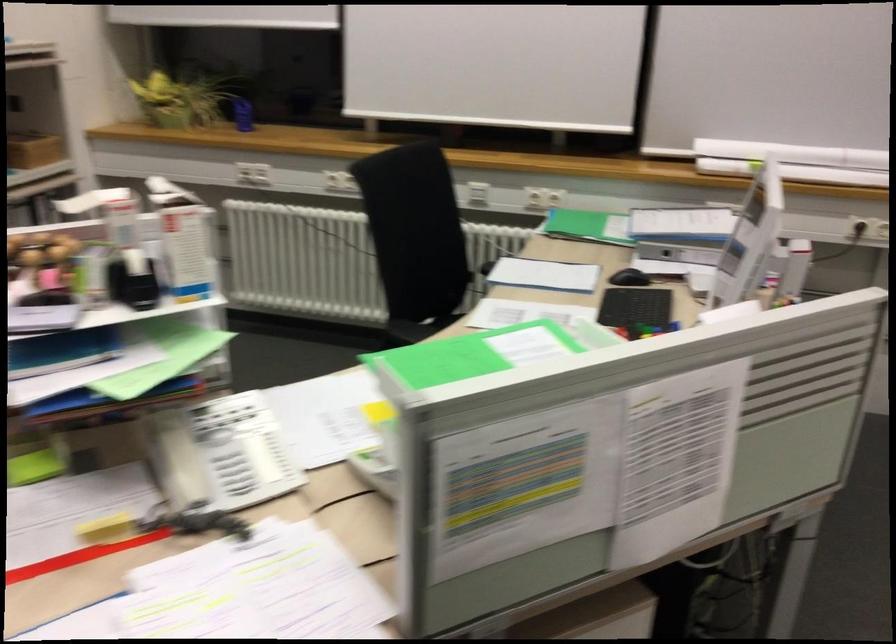
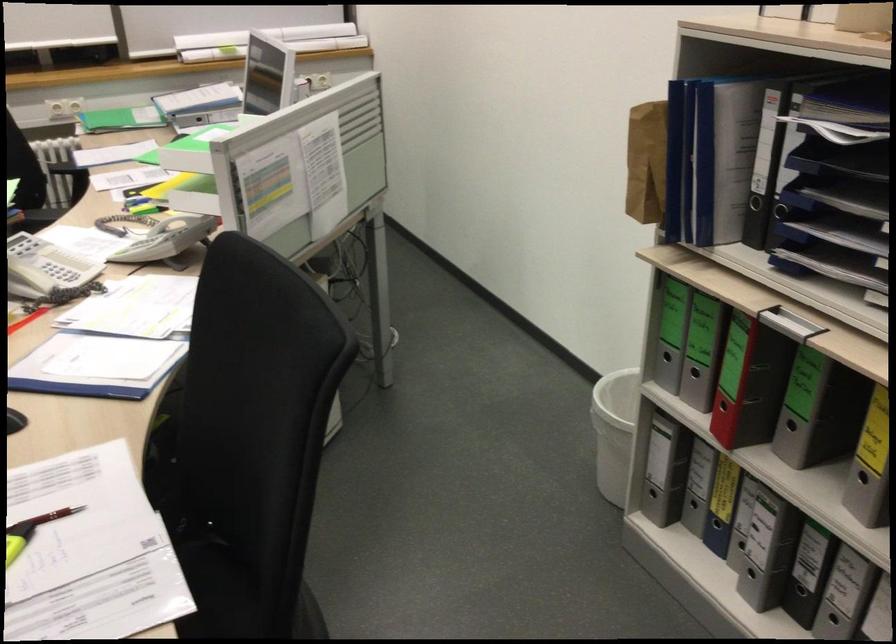
In the second image, find the point that corresponds to (x=128, y=536) in the first image.

(26, 319)